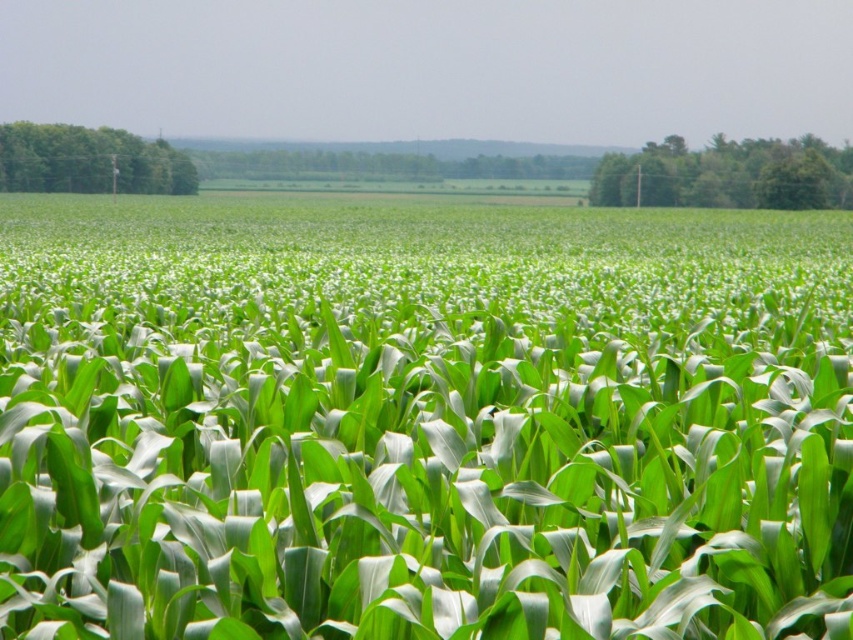
Question: Does green leafy tree at upper right have a lesser width compared to green leafy tree at left?

Choices:
 (A) yes
 (B) no

Answer: (B)

Question: Does green leafy tree at upper right have a larger size compared to green leafy tree at left?

Choices:
 (A) no
 (B) yes

Answer: (B)

Question: Among these points, which one is farthest from the camera?

Choices:
 (A) (22, 484)
 (B) (735, 205)

Answer: (B)

Question: Which point is farther from the camera taking this photo?

Choices:
 (A) (755, 202)
 (B) (682, 556)
 (C) (126, 184)

Answer: (A)

Question: Which of the following is the closest to the observer?

Choices:
 (A) green leafy corn at center
 (B) green leafy tree at left

Answer: (A)

Question: Considering the relative positions of green leafy tree at upper right and green leafy tree at left in the image provided, where is green leafy tree at upper right located with respect to green leafy tree at left?

Choices:
 (A) above
 (B) below

Answer: (B)